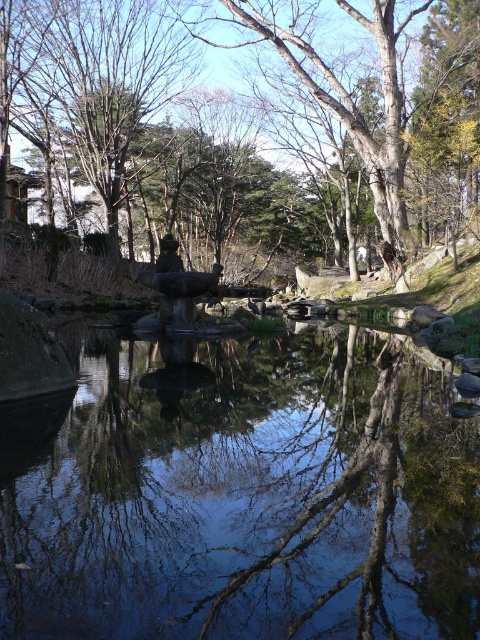
You are standing in front of the serene natural scene described. You want to place a small floating decoration on the surface of the transparent water at center. Considering the position of the brown wood tree at center, will the decoration be visible from your current viewpoint?

The transparent water at center is closer to the viewer than the brown wood tree at center, so yes, the decoration placed on the transparent water at center will be visible from your current viewpoint as it is in front of the tree.

You are an artist trying to paint the scene. You notice the transparent water at center and the brown wood tree at center. Which object takes up more space in the image?

The brown wood tree at center occupies more space than the transparent water at center in the image.